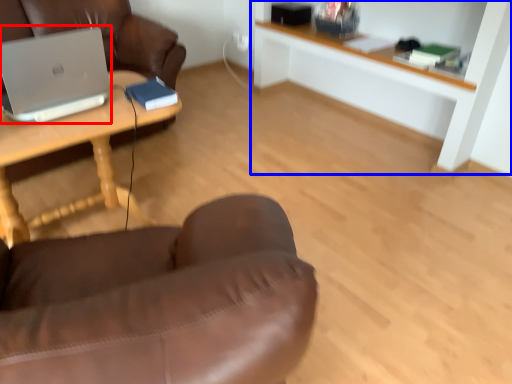
Question: Which of the following is the farthest to the observer, laptop (highlighted by a red box) or shelf (highlighted by a blue box)?

Choices:
 (A) laptop
 (B) shelf

Answer: (B)